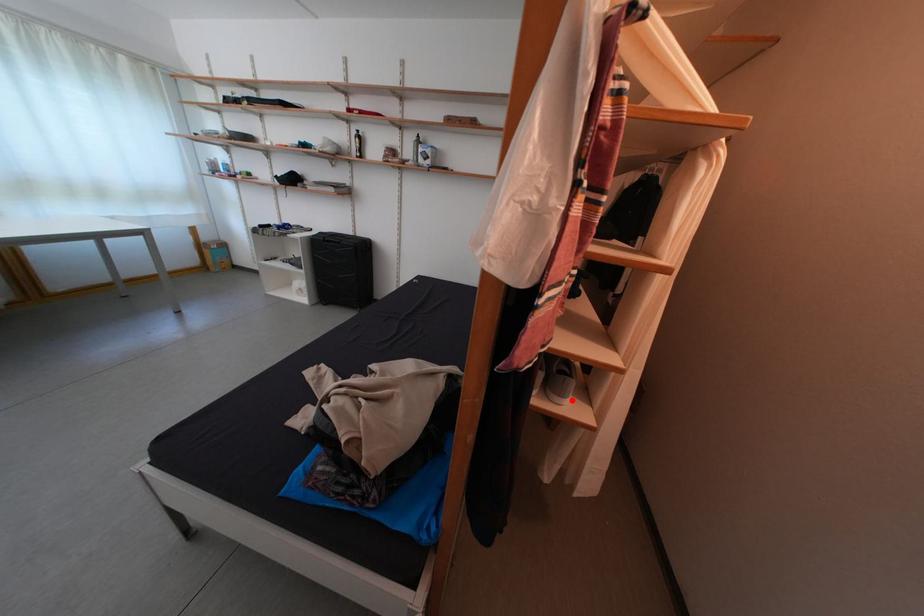
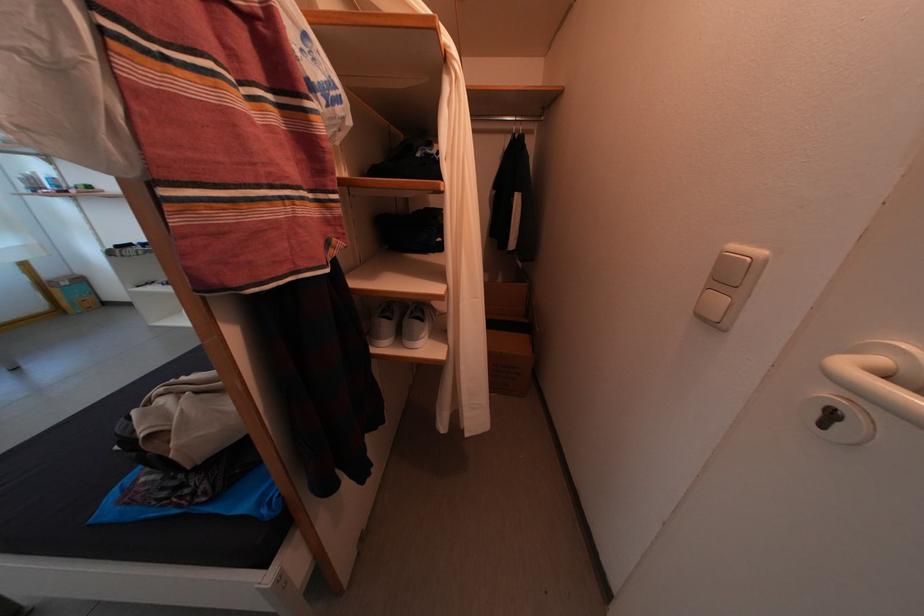
Question: I am providing you with two images of the same scene from different viewpoints. A red point is marked on the first image. At the location where the point appears in image 1, is it still visible in image 2?

Choices:
 (A) Yes
 (B) No

Answer: (A)